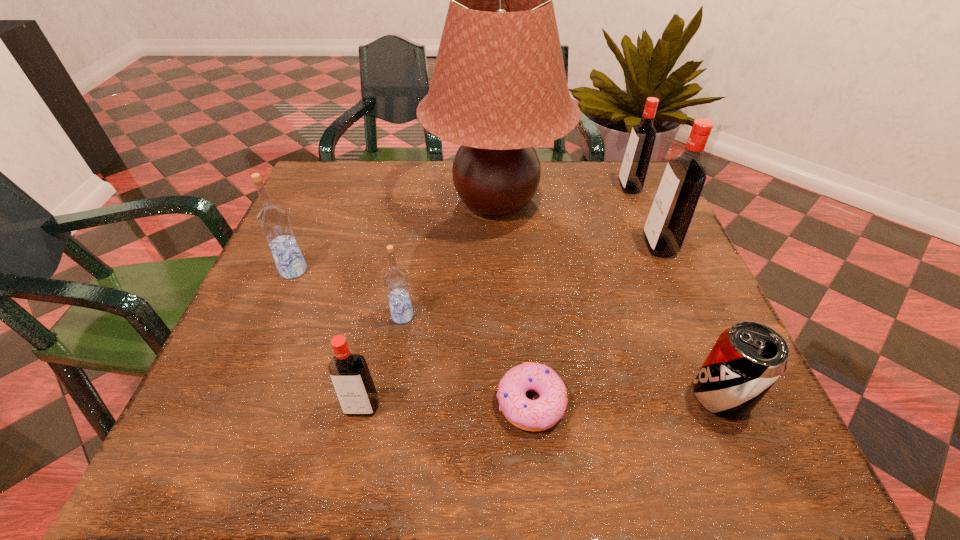
This screenshot has height=540, width=960. Identify the location of vacant space at the left edge of the desktop. (322, 219).

In the image, there is a desktop. Find the location of `free space at the right edge`. free space at the right edge is located at coordinates (677, 266).

Identify the location of vacant space at the far left corner of the desktop. pos(326,202).

In order to click on blank area at the near left corner in this screenshot , I will do `click(227, 423)`.

Image resolution: width=960 pixels, height=540 pixels. What are the coordinates of `vacant area between the bigger blue vodka and the shortest object` in the screenshot? It's located at (412, 336).

Where is `vacant point located between the smallest red vodka and the biggest red vodka`? The width and height of the screenshot is (960, 540). vacant point located between the smallest red vodka and the biggest red vodka is located at coordinates (511, 327).

The width and height of the screenshot is (960, 540). What are the coordinates of `unoccupied area between the soda can and the shortest object` in the screenshot? It's located at (626, 399).

The height and width of the screenshot is (540, 960). Identify the location of free space between the tallest vodka and the fourth nearest object. (531, 281).

Locate an element on the screen. free space between the right blue vodka and the biggest red vodka is located at coordinates (531, 281).

The width and height of the screenshot is (960, 540). Find the location of `free space between the leftmost red vodka and the seventh shortest object`. free space between the leftmost red vodka and the seventh shortest object is located at coordinates (511, 327).